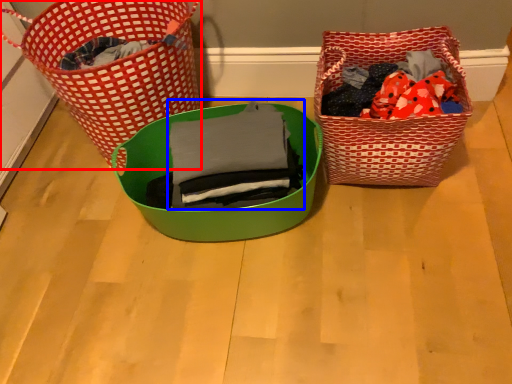
Question: Which object is further to the camera taking this photo, picnic basket (highlighted by a red box) or clothing (highlighted by a blue box)?

Choices:
 (A) picnic basket
 (B) clothing

Answer: (A)